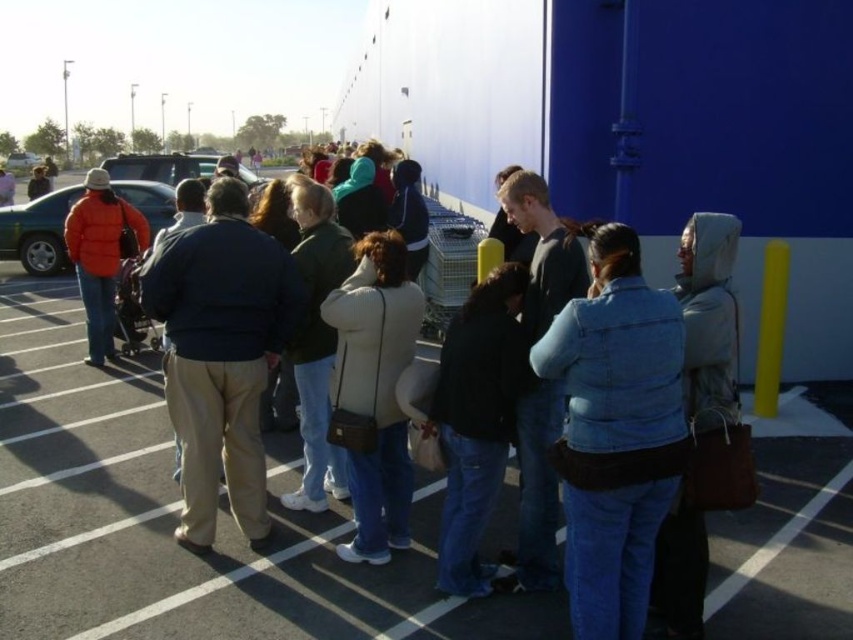
Question: Which point is farther to the camera?

Choices:
 (A) blue denim jeans at center
 (B) dark blue jacket at center
 (C) light gray hooded jacket at right
 (D) orange puffy jacket at left

Answer: (D)

Question: Which of the following is the closest to the observer?

Choices:
 (A) dark gray hoodie at center
 (B) light gray hooded jacket at right
 (C) denim jacket at lower right

Answer: (C)

Question: Does denim jacket at lower right come in front of dark blue jacket at center?

Choices:
 (A) yes
 (B) no

Answer: (A)

Question: Observing the image, what is the correct spatial positioning of light beige jacket at center in reference to dark blue jeans at center?

Choices:
 (A) right
 (B) left

Answer: (B)

Question: Among these objects, which one is farthest from the camera?

Choices:
 (A) dark blue jeans at center
 (B) light beige jacket at center

Answer: (B)

Question: In this image, where is denim jacket at lower right located relative to orange matte jacket at left?

Choices:
 (A) below
 (B) above

Answer: (A)